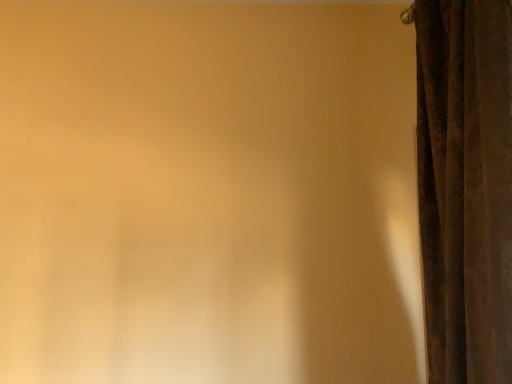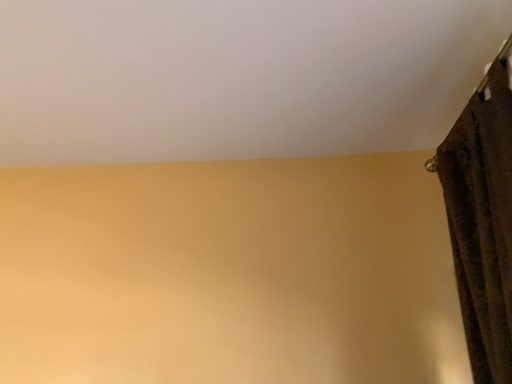
Question: Which way did the camera rotate in the video?

Choices:
 (A) rotated downward
 (B) rotated upward

Answer: (B)